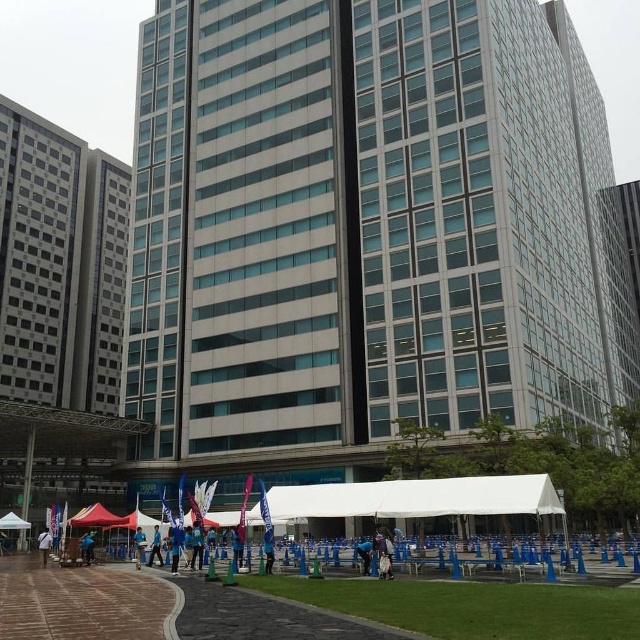
You are standing at the edge of the plaza near the building and want to pick up an item. You see a white fabric bag at lower center and a blue fabric at center. Which item is closer to you?

The white fabric bag at lower center is closer to you since it is only 7.28 meters away from the blue fabric at center, which is farther away.

You are a visitor in this plaza and want to find a place to sit. You see the blue fabric at center and the blue fabric tent at center. Which one would you choose if you want something larger to sit under?

The blue fabric tent at center is larger than the blue fabric at center, so you should choose the blue fabric tent at center.

You are a city planner assessing the plaza area in front of the building. You need to determine if the blue fabric flag at lower center can be placed inside the blue fabric tent at center without folding it. Can it fit?

The blue fabric flag at lower center has a smaller size compared to blue fabric tent at center, so it can fit inside the tent without folding.